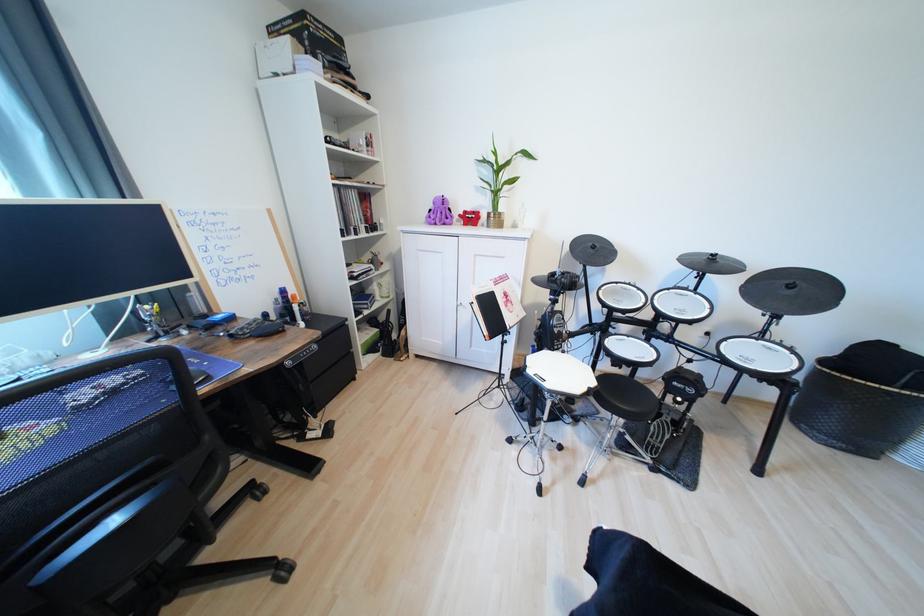
Where would you squeez the purple octopus toy? Please return your answer as a coordinate pair (x, y).

(439, 212)